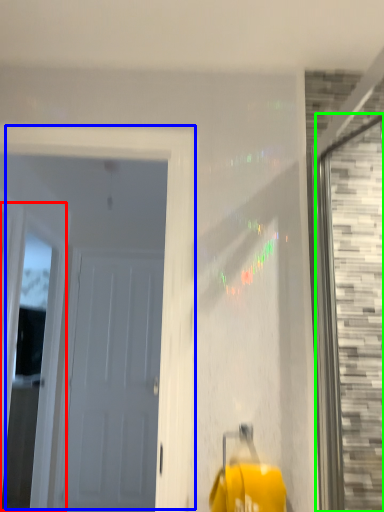
Question: Which is farther away from window (highlighted by a red box)? door (highlighted by a blue box) or window (highlighted by a green box)?

Choices:
 (A) door
 (B) window

Answer: (B)